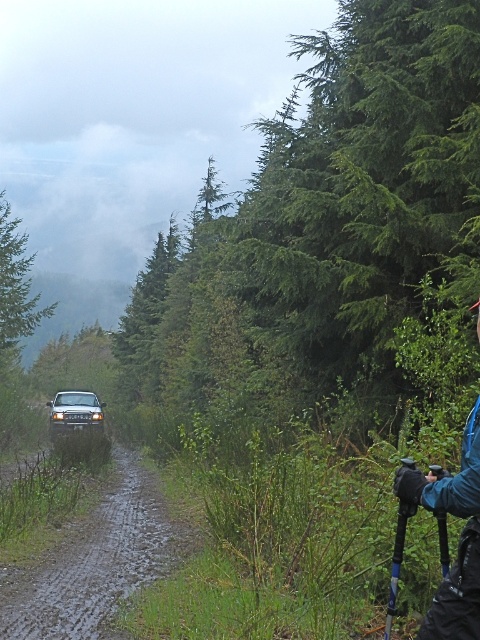
You are a photographer trying to set up your equipment on the muddy dirt road at left. You have a blue fabric camera at lower right. Can you place the camera on the road without it getting dirty?

The muddy dirt road at left is located below the blue fabric camera at lower right, meaning the camera is positioned higher up and not directly on the road. Therefore, placing the camera on the road might require moving it to the lower position, but since the road is muddy, it could get dirty if placed there.

You are driving a car and want to park it on the muddy dirt road at left. However, there is a shiny silver suv at center blocking the way. Based on their positions, can you drive around the SUV to access the road?

The muddy dirt road at left is to the right of the shiny silver suv at center, so you can drive around the SUV by moving to its right side to access the road.

You are navigating through the forest and want to stay on the muddy dirt road at left. Based on the image, what coordinate should you aim for to stay on the road?

The muddy dirt road at left is located at coordinate point [96,561], so you should aim for that coordinate to stay on the road.